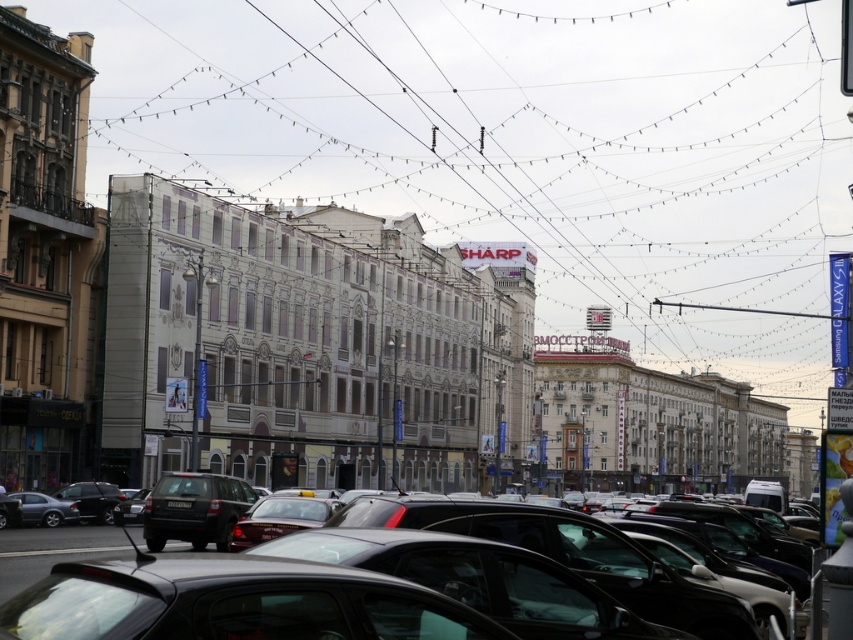
Question: Which of the following is the farthest from the observer?

Choices:
 (A) (485, 529)
 (B) (166, 522)
 (C) (251, 49)

Answer: (C)

Question: Which object appears farthest from the camera in this image?

Choices:
 (A) matte black suv at center
 (B) shiny black car at center
 (C) metallic wire at upper center
 (D) black plastic license plate at center

Answer: (C)

Question: Among these objects, which one is nearest to the camera?

Choices:
 (A) shiny black car at center
 (B) black plastic license plate at center
 (C) metallic wire at upper center

Answer: (A)

Question: From the image, what is the correct spatial relationship of matte black suv at center in relation to black plastic license plate at center?

Choices:
 (A) above
 (B) below

Answer: (B)

Question: Considering the relative positions of shiny black car at center and matte black suv at center in the image provided, where is shiny black car at center located with respect to matte black suv at center?

Choices:
 (A) right
 (B) left

Answer: (A)

Question: From the image, what is the correct spatial relationship of metallic wire at upper center in relation to matte black suv at center?

Choices:
 (A) right
 (B) left

Answer: (A)